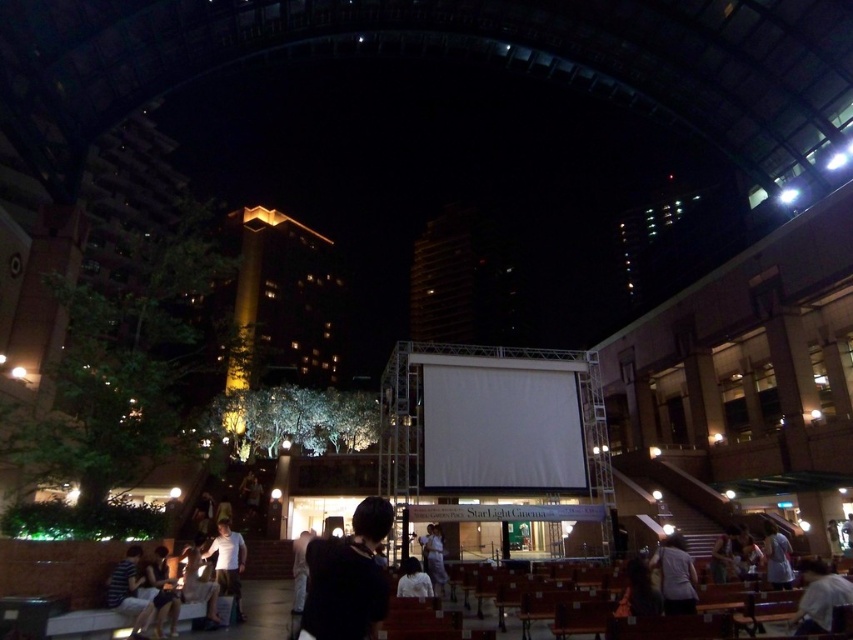
You are standing at the entrance of the cinema and want to find the light purple fabric at center. According to the scene description, where should you look?

The light purple fabric at center is located at point (434,557) in the scene.

You are standing at the cinema entrance and want to find the white cotton shirt at lower center. According to the scene description, where should you look relative to your position?

The white cotton shirt at lower center is located at point (227,561), which means it is positioned towards the lower center area of the scene. Since you are at the cinema entrance, you should look towards the lower center direction, likely towards the benches and screen area where people are gathered.